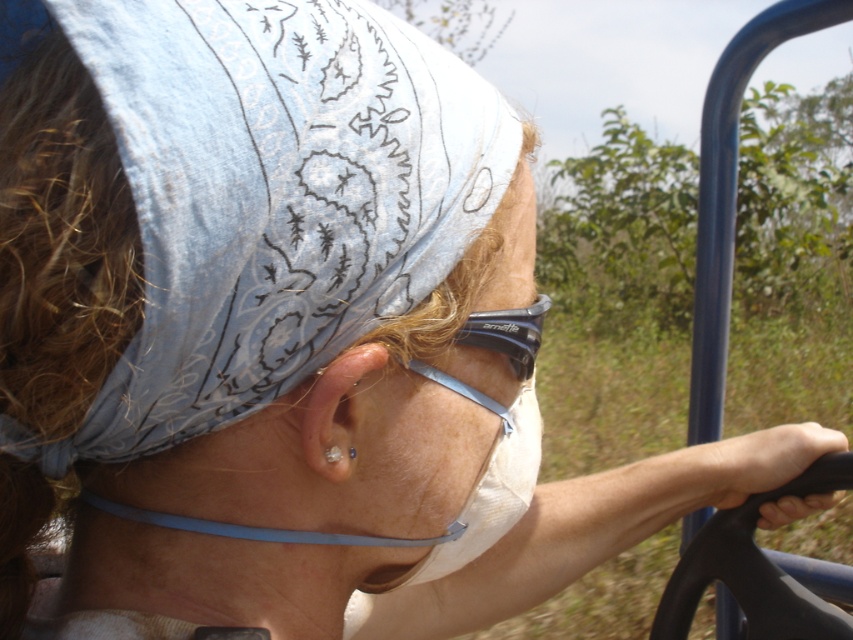
You are standing in front of the golf cart and want to place a small sticker on the point that is closer to you. Which point should you choose between point (384,314) and point (529,244)?

Point (384,314) is closer to the viewer than point (529,244), so you should choose point (384,314) to place the sticker.

In the scene shown: You are a photographer taking a picture of the driver in the golf cart. You want to focus on the point closer to the camera between point (496, 465) and point (468, 332). Which point should you choose?

Point (496, 465) is further to the camera than point (468, 332), so you should choose point (496, 465) to focus on the closer point.

You are a photographer trying to capture a clear photo of the black rubber goggles at upper center. There is a denim bandana at upper left blocking part of the view. To get a better shot, should you move your camera to the right or left?

The denim bandana at upper left is to the left of the black rubber goggles at upper center. To avoid the bandana blocking the view, you should move your camera to the right.